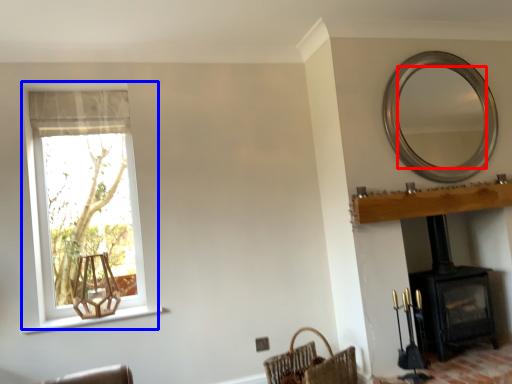
Question: Which object appears closest to the camera in this image, mirror (highlighted by a red box) or window (highlighted by a blue box)?

Choices:
 (A) mirror
 (B) window

Answer: (B)